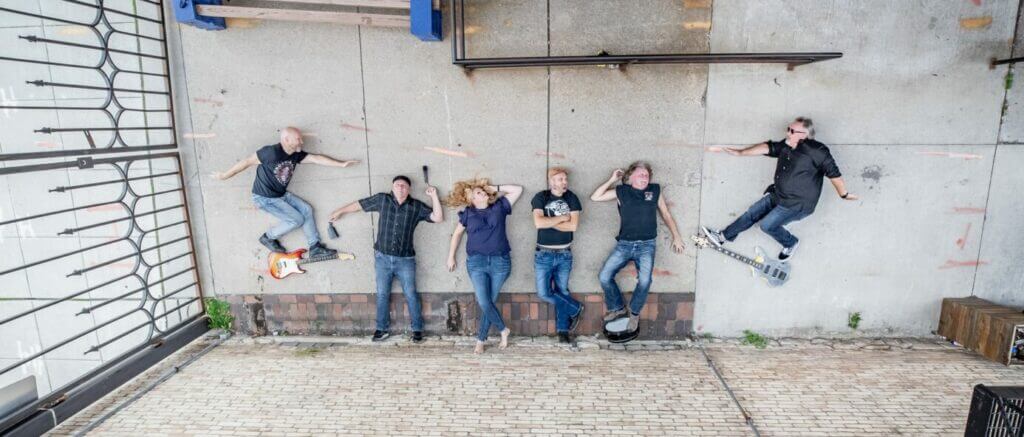
This screenshot has width=1024, height=437. In order to click on concrete floor in this screenshot , I will do `click(870, 246)`.